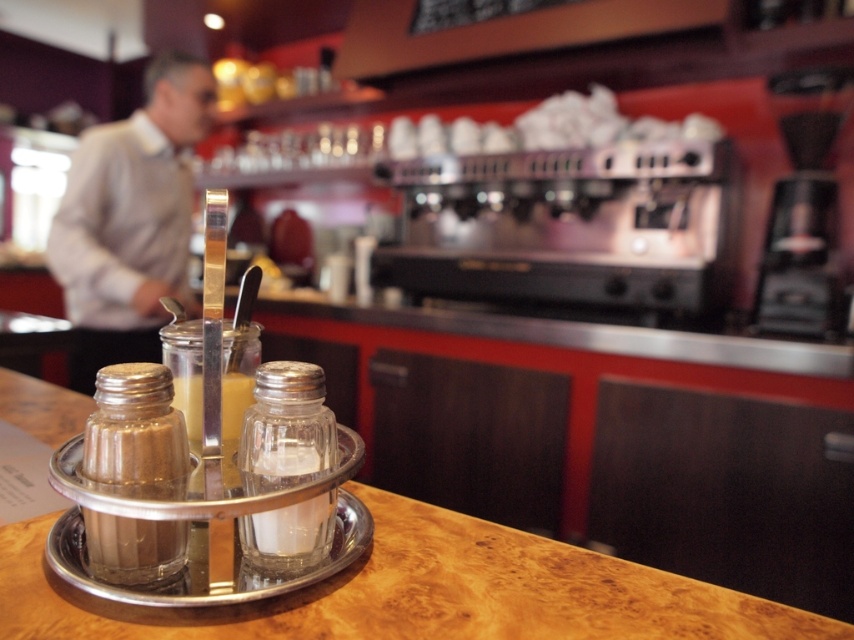
Question: Where is wooden counter at center located in relation to silver metallic salt shaker at center in the image?

Choices:
 (A) left
 (B) right

Answer: (B)

Question: Which point is closer to the camera?

Choices:
 (A) clear glass salt shaker at center
 (B) light gray shirt at left

Answer: (A)

Question: Which of the following is the farthest from the observer?

Choices:
 (A) translucent glass bottle at center
 (B) wooden counter at center
 (C) light gray shirt at left
 (D) silver metallic salt shaker at center

Answer: (C)

Question: Is clear glass salt shaker at center above translucent glass bottle at center?

Choices:
 (A) yes
 (B) no

Answer: (B)

Question: Is the position of silver metallic salt shaker at center more distant than that of clear glass salt shaker at center?

Choices:
 (A) no
 (B) yes

Answer: (A)

Question: Which point is closer to the camera?

Choices:
 (A) (197, 410)
 (B) (60, 259)
 (C) (293, 477)
 (D) (15, 611)

Answer: (D)